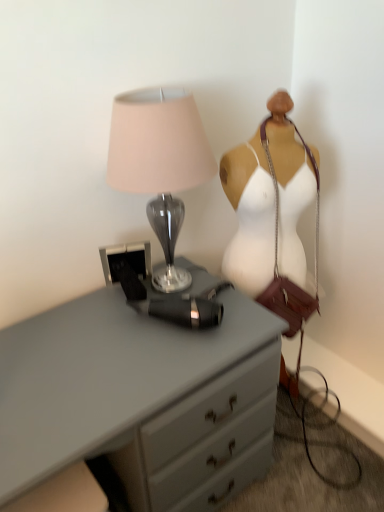
Question: From the image's perspective, does white fabric mannequin at right appear higher than matte gray chest of drawers at center?

Choices:
 (A) no
 (B) yes

Answer: (B)

Question: Is white fabric mannequin at right closer to the viewer compared to matte gray chest of drawers at center?

Choices:
 (A) no
 (B) yes

Answer: (A)

Question: Can you confirm if white fabric mannequin at right is taller than matte gray chest of drawers at center?

Choices:
 (A) yes
 (B) no

Answer: (A)

Question: Does white fabric mannequin at right appear on the left side of matte gray chest of drawers at center?

Choices:
 (A) yes
 (B) no

Answer: (B)

Question: Can you confirm if white fabric mannequin at right is positioned to the right of matte gray chest of drawers at center?

Choices:
 (A) yes
 (B) no

Answer: (A)

Question: From a real-world perspective, is matte gray chest of drawers at center positioned above or below satin gray lamp at upper left?

Choices:
 (A) below
 (B) above

Answer: (A)

Question: Is point (48, 432) closer or farther from the camera than point (165, 231)?

Choices:
 (A) farther
 (B) closer

Answer: (B)

Question: Relative to satin gray lamp at upper left, is matte gray chest of drawers at center in front or behind?

Choices:
 (A) front
 (B) behind

Answer: (A)

Question: Considering the positions of matte gray chest of drawers at center and satin gray lamp at upper left in the image, is matte gray chest of drawers at center bigger or smaller than satin gray lamp at upper left?

Choices:
 (A) big
 (B) small

Answer: (A)

Question: Is point (180, 118) closer or farther from the camera than point (289, 199)?

Choices:
 (A) closer
 (B) farther

Answer: (A)

Question: From the image's perspective, relative to white fabric mannequin at right, is satin gray lamp at upper left above or below?

Choices:
 (A) below
 (B) above

Answer: (B)

Question: Considering the positions of satin gray lamp at upper left and white fabric mannequin at right in the image, is satin gray lamp at upper left wider or thinner than white fabric mannequin at right?

Choices:
 (A) wide
 (B) thin

Answer: (A)

Question: From a real-world perspective, is satin gray lamp at upper left physically located above or below white fabric mannequin at right?

Choices:
 (A) below
 (B) above

Answer: (B)

Question: From a real-world perspective, is white fabric mannequin at right physically located above or below satin gray lamp at upper left?

Choices:
 (A) below
 (B) above

Answer: (A)

Question: In the image, is white fabric mannequin at right on the left side or the right side of satin gray lamp at upper left?

Choices:
 (A) right
 (B) left

Answer: (A)